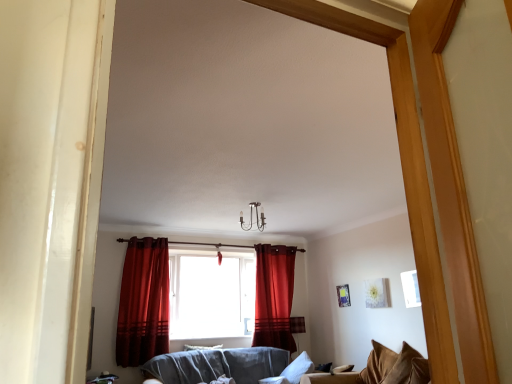
Question: In terms of size, does velvet brown couch at lower right appear bigger or smaller than velvet brown pillow at lower right, which ranks as the first pillow in front-to-back order?

Choices:
 (A) big
 (B) small

Answer: (A)

Question: Is point (404, 362) closer or farther from the camera than point (393, 377)?

Choices:
 (A) farther
 (B) closer

Answer: (B)

Question: Considering the real-world distances, which object is farthest from the velvet gray couch at center?

Choices:
 (A) translucent fabric curtain at center
 (B) velvet red curtain at center, which is counted as the 2th curtain, starting from the front
 (C) velvet red curtain at center, the second curtain when ordered from back to front
 (D) velvet brown couch at lower right
 (E) velvet brown pillow at lower right, acting as the 1th pillow starting from the right

Answer: (E)

Question: Based on their relative distances, which object is farther from the velvet red curtain at center, which is counted as the 2th curtain, starting from the front?

Choices:
 (A) velvet brown couch at lower right
 (B) velvet gray couch at center
 (C) white soft pillow at lower center, arranged as the first pillow when viewed from the back
 (D) translucent fabric curtain at center
 (E) velvet red curtain at center, arranged as the 1th curtain when viewed from the front

Answer: (E)